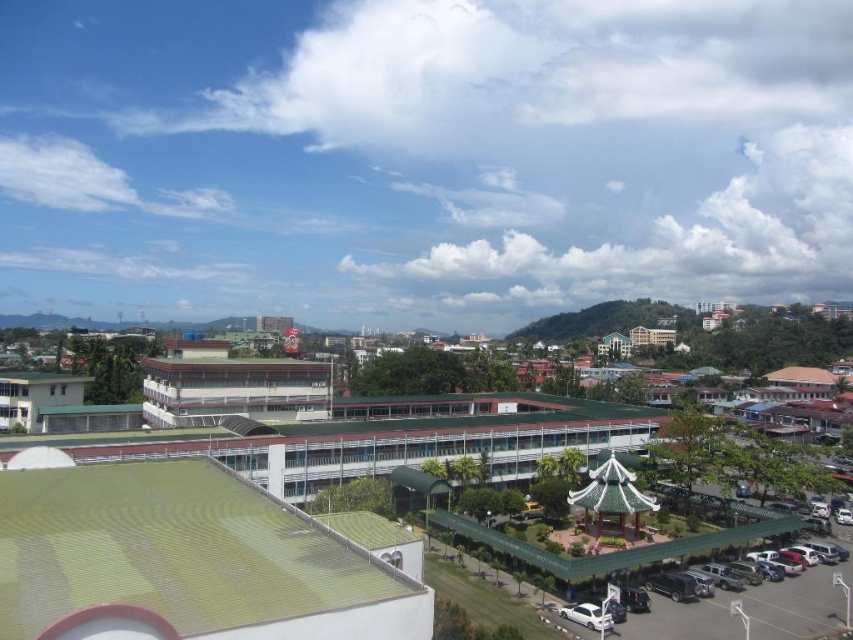
Question: Is green corrugated metal roof at lower left to the right of green matte building at left from the viewer's perspective?

Choices:
 (A) no
 (B) yes

Answer: (B)

Question: Which point is closer to the camera?

Choices:
 (A) pos(581,611)
 (B) pos(637,333)
 (C) pos(181,376)

Answer: (A)

Question: Which object is closer to the camera taking this photo?

Choices:
 (A) white glossy car at lower center
 (B) green matte building at left
 (C) green textured building at center-right
 (D) white matte building at center

Answer: (A)

Question: Which point is closer to the camera?

Choices:
 (A) (809, 628)
 (B) (78, 552)
 (C) (578, 605)

Answer: (B)

Question: Is the position of green corrugated metal roof at lower left more distant than that of green metal parking lot at lower right?

Choices:
 (A) yes
 (B) no

Answer: (B)

Question: From the image, what is the correct spatial relationship of green corrugated metal roof at lower left in relation to green matte building at left?

Choices:
 (A) left
 (B) right

Answer: (B)